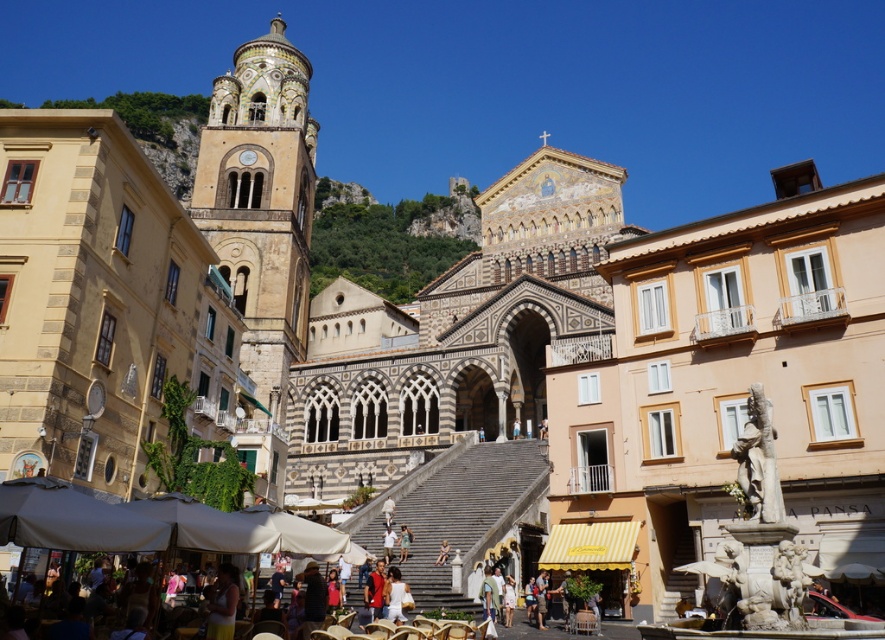
Measure the distance between point [516,573] and camera.

Point [516,573] is 51.88 meters away from camera.

Does point (466, 577) come farther from viewer compared to point (436, 563)?

No.

I want to click on gray stone stairs at center, so click(464, 516).

Does golden mosaic bell tower at center-left have a greater height compared to gray stone stairs at center?

Indeed, golden mosaic bell tower at center-left has a greater height compared to gray stone stairs at center.

In the scene shown: Who is positioned more to the right, golden mosaic bell tower at center-left or gray stone stairs at center?

From the viewer's perspective, gray stone stairs at center appears more on the right side.

Who is more forward, (291, 342) or (491, 500)?

Point (491, 500)

At what (x,y) coordinates should I click in order to perform the action: click on golden mosaic bell tower at center-left. Please return your answer as a coordinate pair (x, y). The image size is (885, 640). Looking at the image, I should click on (260, 230).

Is multicolored mosaic church at center above matte white statue at center?

Correct, multicolored mosaic church at center is located above matte white statue at center.

Can you confirm if multicolored mosaic church at center is positioned to the left of matte white statue at center?

No, multicolored mosaic church at center is not to the left of matte white statue at center.

Is point (605, 348) behind point (445, 552)?

Yes, point (605, 348) is behind point (445, 552).

Locate an element on the screen. This screenshot has height=640, width=885. multicolored mosaic church at center is located at coordinates (458, 336).